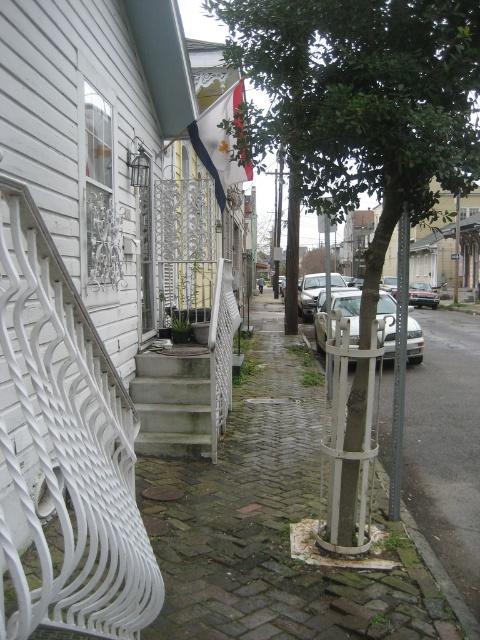
You are standing at the entrance of the white painted house with a decorative wrought iron railing. You want to walk straight ahead towards the center of the image. Will you encounter the white painted metal tree at center before reaching the middle of the cobblestone street?

The white painted metal tree at center is located at coordinates (445, 449), which places it near the lower right portion of the image. Since you are starting at the entrance of the house and walking straight ahead towards the center, you would reach the middle of the cobblestone street before encountering the white painted metal tree at center.

You are standing at the point marked as point (172, 403). Which object are you standing on?

You are standing on the green mossy concrete stairs at center.

You are a delivery person trying to park your satin silver car at center in a narrow alley between two buildings. There is a white painted metal tree at center in the way. Can your car fit through the space if the tree is removed?

The white painted metal tree at center is bigger than the satin silver car at center. If the tree is removed, the space would be sufficient for the satin silver car at center to pass through since the car is smaller in size.